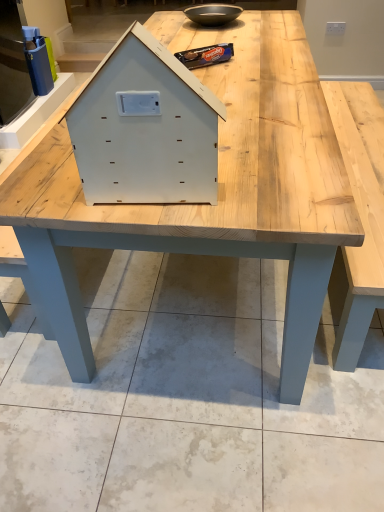
Question: Is point (142, 147) closer or farther from the camera than point (71, 164)?

Choices:
 (A) closer
 (B) farther

Answer: (A)

Question: Based on their sizes in the image, would you say white matte wooden house at center is bigger or smaller than light wood table at center?

Choices:
 (A) big
 (B) small

Answer: (B)

Question: Estimate the real-world distances between objects in this image. Which object is closer to the light wood table at center?

Choices:
 (A) matte black bowl at upper center
 (B) white matte wooden house at center

Answer: (B)

Question: Estimate the real-world distances between objects in this image. Which object is farther from the white matte wooden house at center?

Choices:
 (A) matte black bowl at upper center
 (B) light wood table at center

Answer: (A)